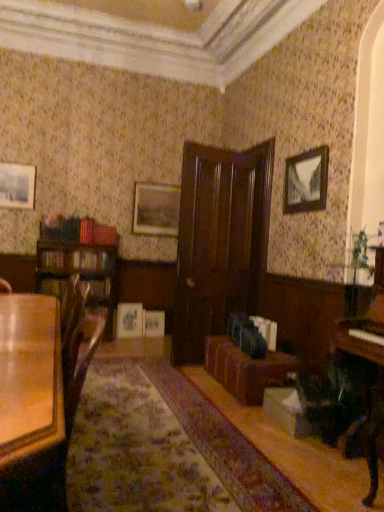
Question: Is the depth of matte silver picture frame at center, positioned as the fourth picture frame in front-to-back order, less than that of glossy wood table at lower left?

Choices:
 (A) no
 (B) yes

Answer: (A)

Question: Does matte silver picture frame at center, positioned as the fourth picture frame in front-to-back order, appear on the left side of glossy wood table at lower left?

Choices:
 (A) yes
 (B) no

Answer: (B)

Question: Can you confirm if matte silver picture frame at center, the 2th picture frame from the back, is wider than glossy wood table at lower left?

Choices:
 (A) yes
 (B) no

Answer: (B)

Question: From the image's perspective, does matte silver picture frame at center, which is the third picture frame from bottom to top, appear higher than glossy wood table at lower left?

Choices:
 (A) yes
 (B) no

Answer: (A)

Question: Is matte silver picture frame at center, the 2th picture frame in the right-to-left sequence, looking in the opposite direction of glossy wood table at lower left?

Choices:
 (A) yes
 (B) no

Answer: (B)

Question: Looking at their shapes, would you say matte white picture frame at center, the third picture frame when ordered from back to front, is wider or thinner than wooden picture frame at upper right, which is counted as the fifth picture frame, starting from the back?

Choices:
 (A) wide
 (B) thin

Answer: (A)

Question: Which is correct: matte white picture frame at center, the third picture frame when ordered from back to front, is inside wooden picture frame at upper right, which is counted as the fifth picture frame, starting from the back, or outside of it?

Choices:
 (A) outside
 (B) inside

Answer: (A)

Question: Considering their positions, is matte white picture frame at center, acting as the 2th picture frame starting from the left, located in front of or behind wooden picture frame at upper right, acting as the second picture frame starting from the top?

Choices:
 (A) front
 (B) behind

Answer: (B)

Question: Is point (137, 327) closer or farther from the camera than point (296, 194)?

Choices:
 (A) closer
 (B) farther

Answer: (B)

Question: Is matte silver picture frame at center, which is the 4th picture frame in left-to-right order, inside the boundaries of matte wooden picture frame at center, the fifth picture frame from the front, or outside?

Choices:
 (A) inside
 (B) outside

Answer: (B)

Question: Considering the positions of matte silver picture frame at center, the 3th picture frame in the top-to-bottom sequence, and matte wooden picture frame at center, positioned as the first picture frame in bottom-to-top order, in the image, is matte silver picture frame at center, the 3th picture frame in the top-to-bottom sequence, taller or shorter than matte wooden picture frame at center, positioned as the first picture frame in bottom-to-top order,?

Choices:
 (A) short
 (B) tall

Answer: (B)

Question: In the image, is matte silver picture frame at center, the 2th picture frame in the right-to-left sequence, positioned in front of or behind matte wooden picture frame at center, which appears as the first picture frame when viewed from the back?

Choices:
 (A) front
 (B) behind

Answer: (A)

Question: Looking at the image, does matte silver picture frame at center, the 2th picture frame from the back, seem bigger or smaller compared to matte wooden picture frame at center, positioned as the first picture frame in bottom-to-top order?

Choices:
 (A) small
 (B) big

Answer: (B)

Question: From the image's perspective, is matte wooden picture frame at center, positioned as the first picture frame in bottom-to-top order, located above or below wooden picture frame at upper right, placed as the first picture frame when sorted from front to back?

Choices:
 (A) above
 (B) below

Answer: (B)

Question: Considering the positions of point (142, 334) and point (309, 165), is point (142, 334) closer or farther from the camera than point (309, 165)?

Choices:
 (A) closer
 (B) farther

Answer: (B)